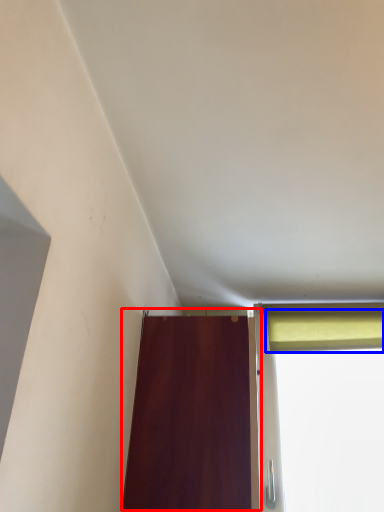
Question: Which object is further to the camera taking this photo, door (highlighted by a red box) or curtain (highlighted by a blue box)?

Choices:
 (A) door
 (B) curtain

Answer: (B)